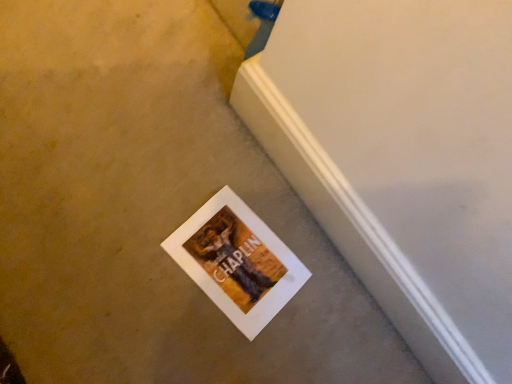
At what (x,y) coordinates should I click in order to perform the action: click on vacant area located to the right-hand side of white matte picture frame at lower center. Please return your answer as a coordinate pair (x, y). The image size is (512, 384). Looking at the image, I should click on (305, 326).